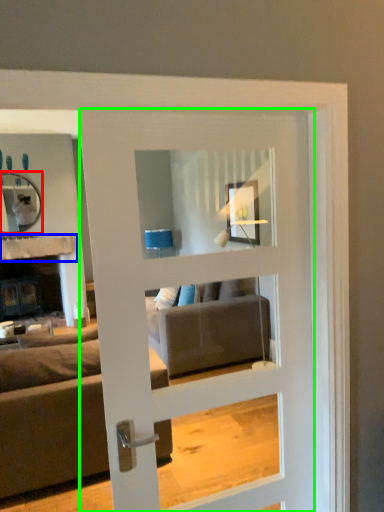
Question: Considering the real-world distances, which object is closest to mirror (highlighted by a red box)? balustrade (highlighted by a blue box) or door (highlighted by a green box).

Choices:
 (A) balustrade
 (B) door

Answer: (A)